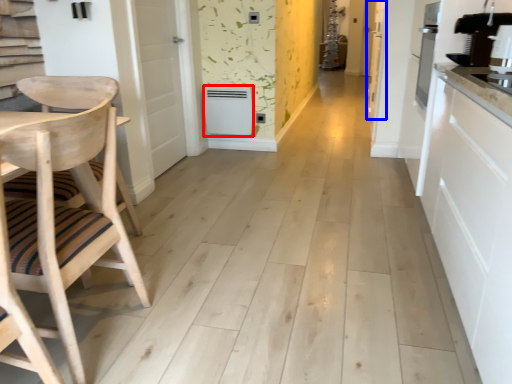
Question: Which of the following is the closest to the observer, appliance (highlighted by a red box) or door (highlighted by a blue box)?

Choices:
 (A) appliance
 (B) door

Answer: (A)